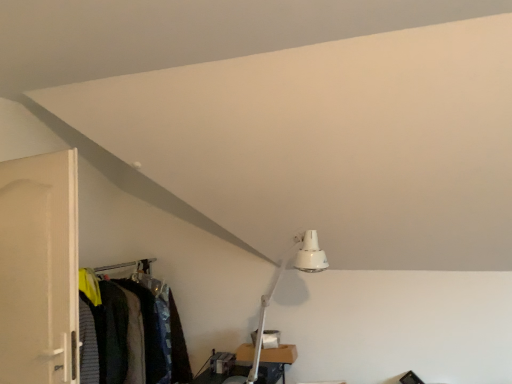
This screenshot has height=384, width=512. I want to click on white matte door at left, so click(x=39, y=269).

Image resolution: width=512 pixels, height=384 pixels. Describe the element at coordinates (39, 269) in the screenshot. I see `white matte door at left` at that location.

From the picture: What is the approximate height of textured fabric closet at lower left?

The height of textured fabric closet at lower left is 38.39 inches.

Find the location of a particular element. This screenshot has width=512, height=384. textured fabric closet at lower left is located at coordinates (144, 332).

What do you see at coordinates (144, 332) in the screenshot?
I see `textured fabric closet at lower left` at bounding box center [144, 332].

In order to click on white matte door at left in this screenshot , I will do click(39, 269).

Does white matte door at left appear on the left side of textured fabric closet at lower left?

Indeed, white matte door at left is positioned on the left side of textured fabric closet at lower left.

Relative to textured fabric closet at lower left, is white matte door at left in front or behind?

In the image, white matte door at left appears in front of textured fabric closet at lower left.

Which is behind, point (18, 303) or point (98, 334)?

The point (98, 334) is farther.

From the image's perspective, would you say white matte door at left is shown under textured fabric closet at lower left?

No, from the image's perspective, white matte door at left is not below textured fabric closet at lower left.

From a real-world perspective, between white matte door at left and textured fabric closet at lower left, who is vertically lower?

From a 3D spatial view, textured fabric closet at lower left is below.

Does white matte door at left have a lesser width compared to textured fabric closet at lower left?

Yes.

Between white matte door at left and textured fabric closet at lower left, which one has more height?

white matte door at left is taller.

Considering the sizes of objects white matte door at left and textured fabric closet at lower left in the image provided, who is bigger, white matte door at left or textured fabric closet at lower left?

With larger size is white matte door at left.

Would you say white matte door at left is outside textured fabric closet at lower left?

white matte door at left is positioned outside textured fabric closet at lower left.

Would you consider white matte door at left to be distant from textured fabric closet at lower left?

No.

Could you tell me if white matte door at left is turned towards textured fabric closet at lower left?

No, white matte door at left does not turn towards textured fabric closet at lower left.

You are a GUI agent. You are given a task and a screenshot of the screen. Output one action in this format:
    pyautogui.click(x=<x>, y=<y>)
    Task: Click on the closet behind the white matte door at left
    
    Given the screenshot: What is the action you would take?
    pyautogui.click(x=144, y=332)

Looking at this image, visually, is textured fabric closet at lower left positioned to the left or to the right of white matte door at left?

In the image, textured fabric closet at lower left appears on the right side of white matte door at left.

Is the depth of textured fabric closet at lower left greater than that of white matte door at left?

Yes, it is behind white matte door at left.

Which is closer to the camera, (111, 286) or (10, 194)?

The point (10, 194) is closer.

From the image's perspective, between textured fabric closet at lower left and white matte door at left, who is located below?

textured fabric closet at lower left, from the image's perspective.

From a real-world perspective, does textured fabric closet at lower left sit lower than white matte door at left?

Yes.

Is textured fabric closet at lower left wider or thinner than white matte door at left?

Clearly, textured fabric closet at lower left has more width compared to white matte door at left.

Who is taller, textured fabric closet at lower left or white matte door at left?

With more height is white matte door at left.

Who is smaller, textured fabric closet at lower left or white matte door at left?

textured fabric closet at lower left is smaller.

Can we say textured fabric closet at lower left lies outside white matte door at left?

Indeed, textured fabric closet at lower left is completely outside white matte door at left.

Would you say textured fabric closet at lower left is a long distance from white matte door at left?

textured fabric closet at lower left is near white matte door at left, not far away.

From the picture: Is textured fabric closet at lower left aimed at white matte door at left?

No, textured fabric closet at lower left is not aimed at white matte door at left.

What's the angular difference between textured fabric closet at lower left and white matte door at left's facing directions?

The angle between the facing direction of textured fabric closet at lower left and the facing direction of white matte door at left is 94.9 degrees.

The height and width of the screenshot is (384, 512). In order to click on closet that is behind the white matte door at left in this screenshot , I will do `click(144, 332)`.

The image size is (512, 384). I want to click on closet below the white matte door at left (from a real-world perspective), so click(144, 332).

Where is `door above the textured fabric closet at lower left (from a real-world perspective)`? The width and height of the screenshot is (512, 384). door above the textured fabric closet at lower left (from a real-world perspective) is located at coordinates 39,269.